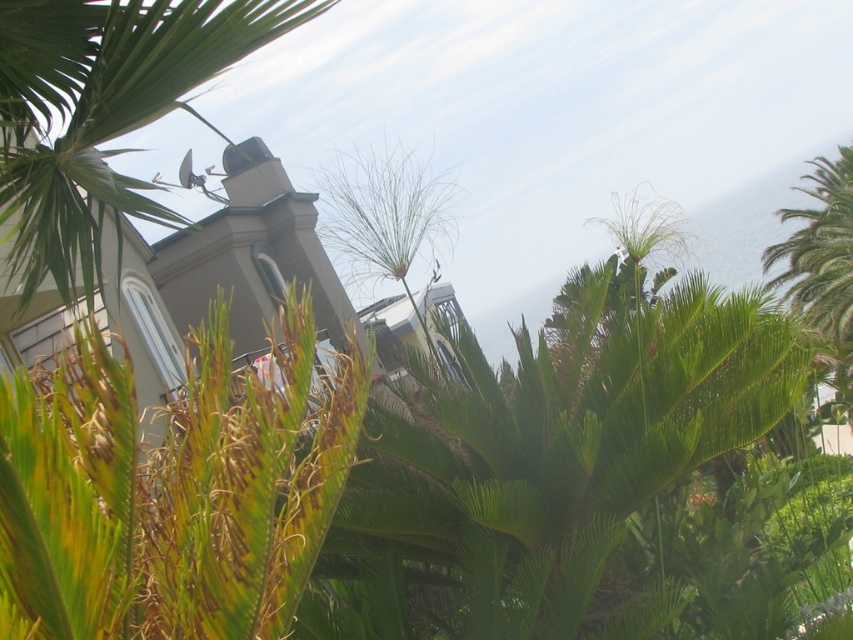
Does point (61, 262) lie in front of point (798, 292)?

That is True.

Is green leafy palm tree at upper left wider than green leafy palm tree at upper right?

In fact, green leafy palm tree at upper left might be narrower than green leafy palm tree at upper right.

You are a GUI agent. You are given a task and a screenshot of the screen. Output one action in this format:
    pyautogui.click(x=<x>, y=<y>)
    Task: Click on the green leafy palm tree at upper left
    The width and height of the screenshot is (853, 640).
    Given the screenshot: What is the action you would take?
    pyautogui.click(x=115, y=124)